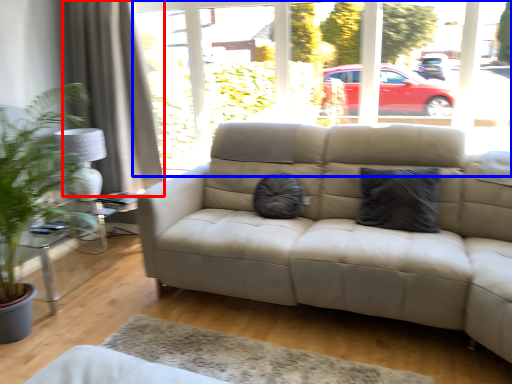
Question: Which point is further to the camera, curtain (highlighted by a red box) or window frame (highlighted by a blue box)?

Choices:
 (A) curtain
 (B) window frame

Answer: (A)